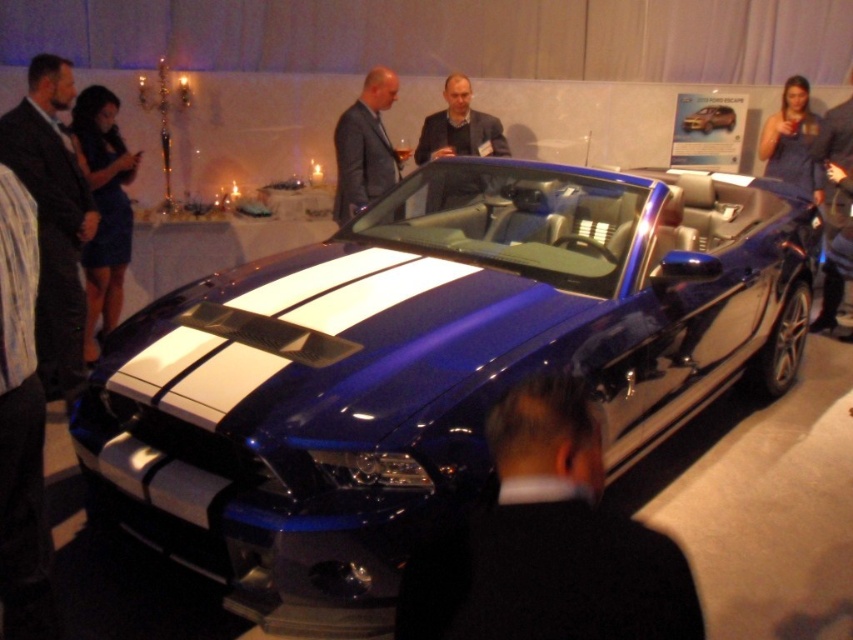
You are a photographer setting up a shoot for a car magazine. You want to ensure that the shiny blue convertible at center is the main focus of the photo. Given that the matte gray suit at center is also present, how can you use their height difference to emphasize the car?

Since the shiny blue convertible at center is taller than the matte gray suit at center, positioning the camera at a lower angle would highlight the car by making it dominate the frame vertically, while the shorter matte gray suit at center can be placed in the foreground to add context without overshadowing the vehicle.

You are a photographer at the car exhibition and need to position the black leather jacket at lower center and the matte gray suit at center so that both are visible in the frame. Since you can only adjust their positions horizontally, which object should you move to the left to make space?

Since the black leather jacket at lower center is wider than the matte gray suit at center, you should move the black leather jacket at lower center to the left to create more space for both objects to fit in the frame.